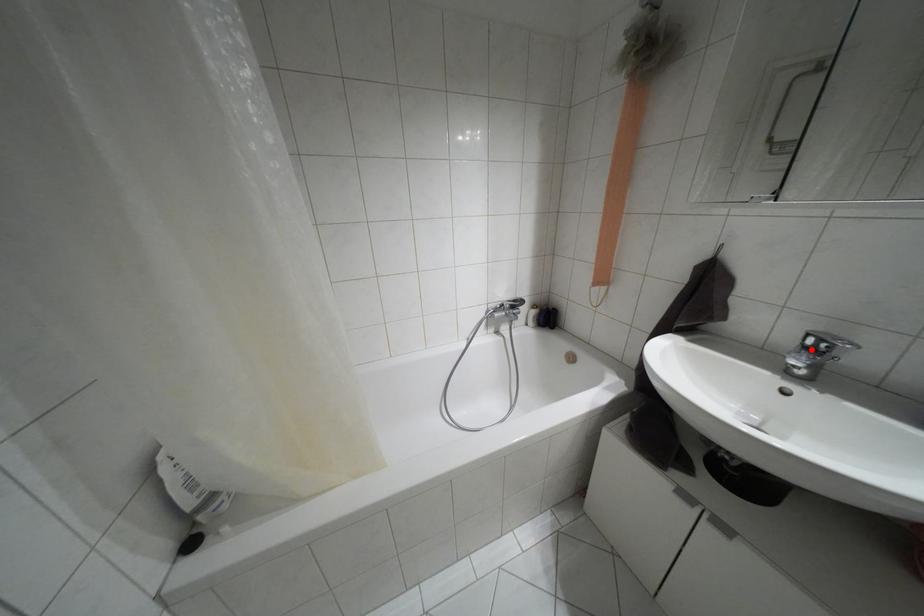
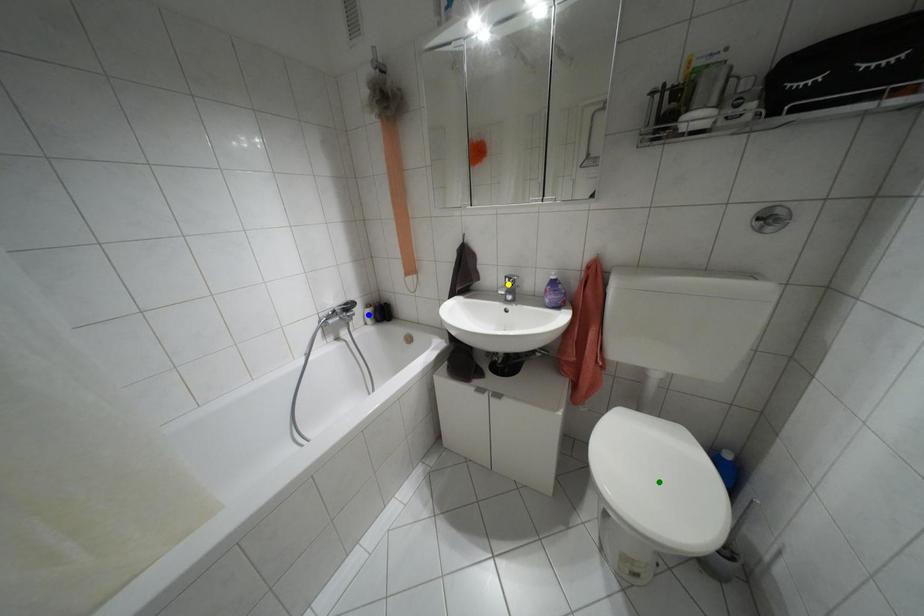
Question: I am providing you with two images of the same scene from different viewpoints. A red point is marked on the first image. You are given multiple points on the second image. Which point in image 2 represents the same 3d spot as the red point in image 1?

Choices:
 (A) blue point
 (B) yellow point
 (C) green point

Answer: (B)